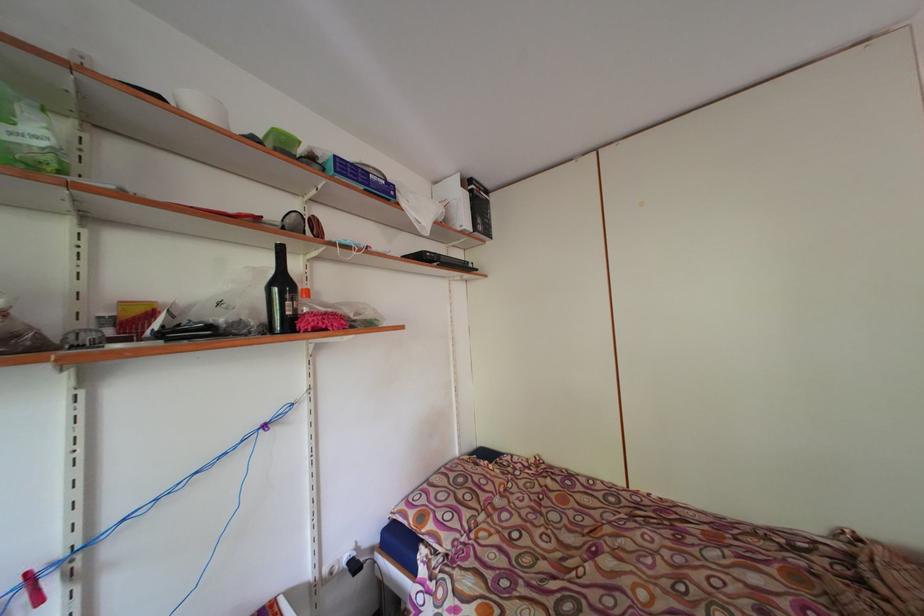
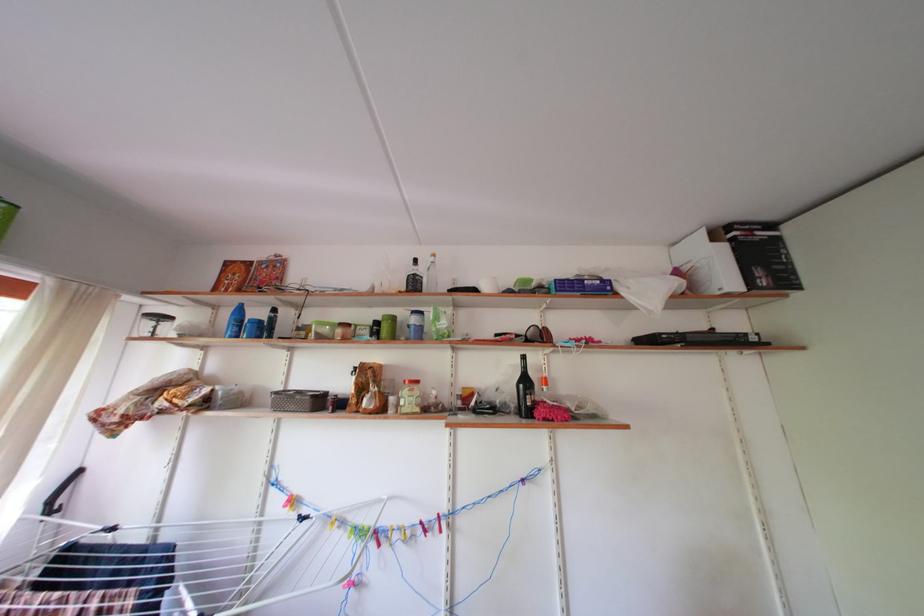
In the second image, find the point that corresponds to pixel 470 192 in the first image.

(721, 246)